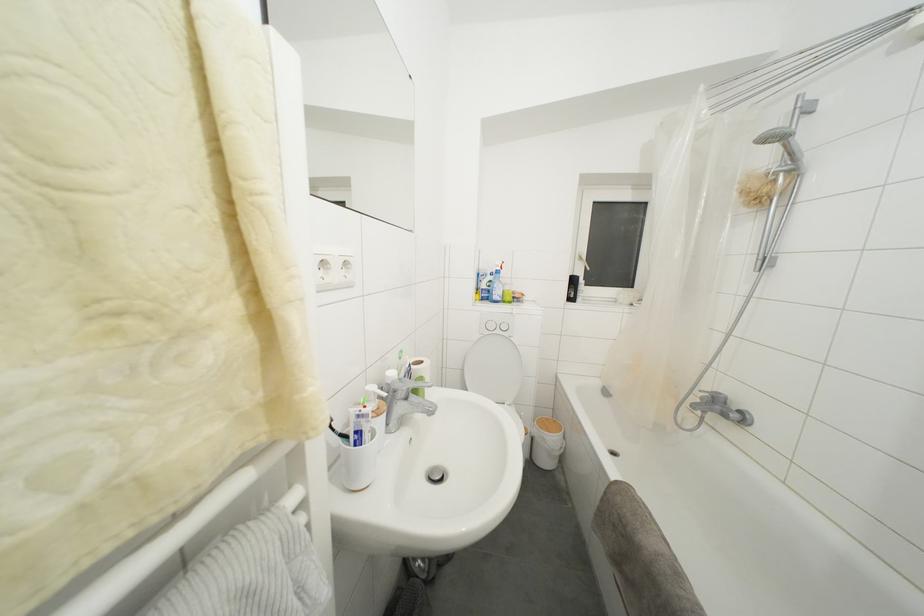
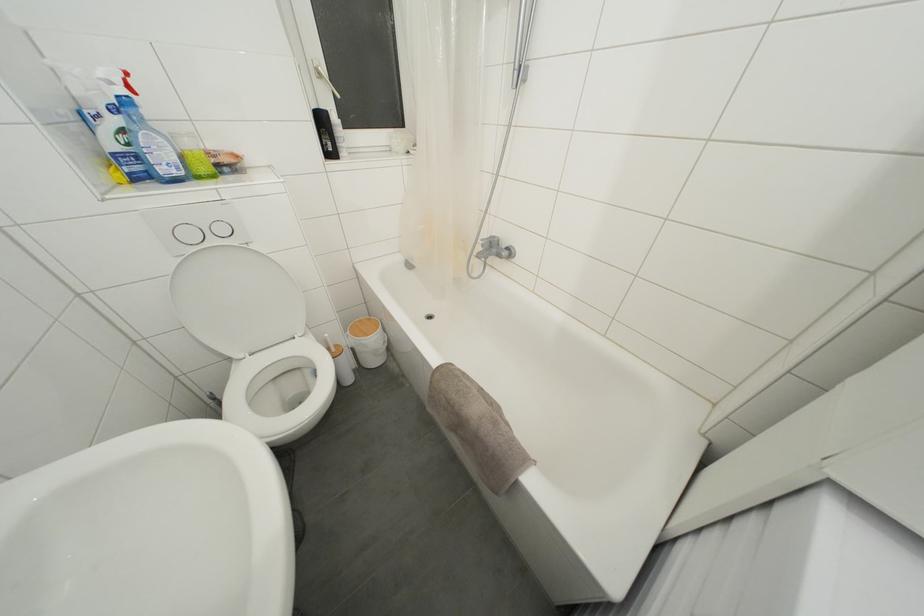
In the second image, find the point that corresponds to (x=495, y=331) in the first image.

(195, 240)